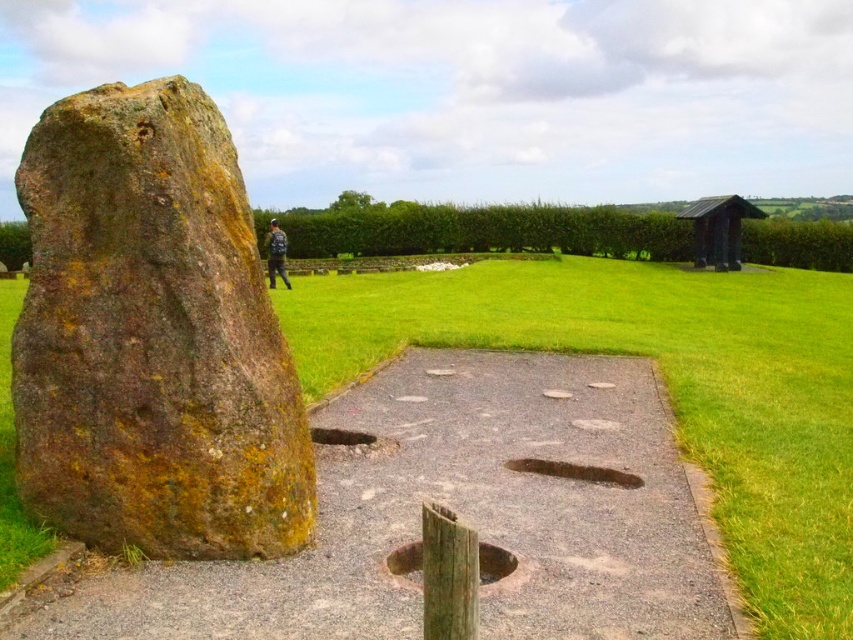
You are a hiker who wants to take a photo of the brown rough stone at center and the blue fabric jacket at upper center. Which object should you focus on first if you want to ensure both are in focus without adjusting the camera settings?

The brown rough stone at center is thinner than the blue fabric jacket at upper center, so you should focus on the blue fabric jacket at upper center first to ensure both are in focus.